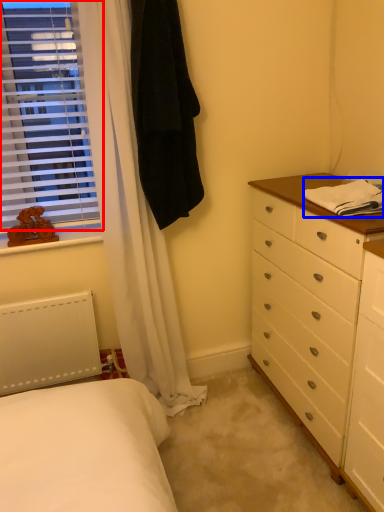
Question: Among these objects, which one is nearest to the camera, window (highlighted by a red box) or blanket (highlighted by a blue box)?

Choices:
 (A) window
 (B) blanket

Answer: (B)